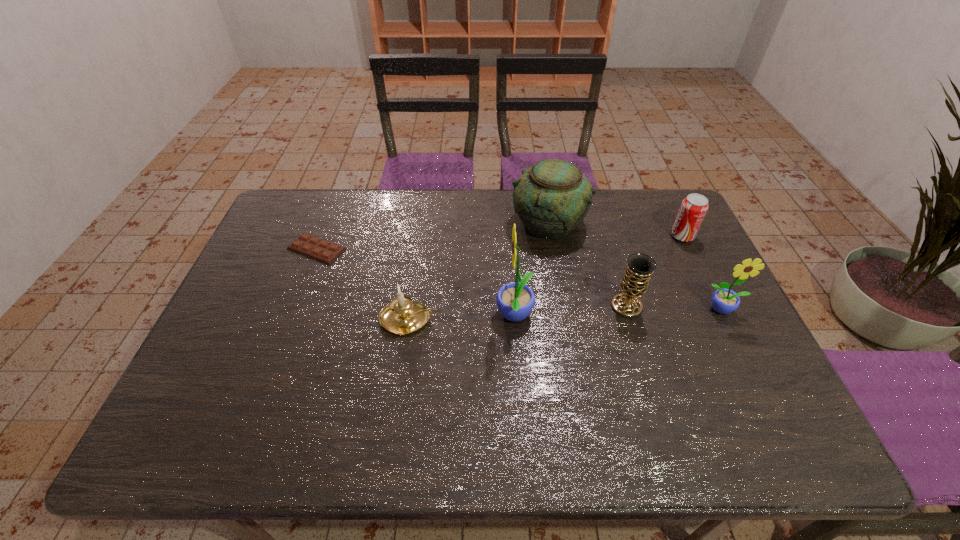
Find the location of a particular element. blank region between the leftmost object and the soda can is located at coordinates (499, 242).

Image resolution: width=960 pixels, height=540 pixels. What are the coordinates of `free spot between the leftmost object and the fifth object from left to right` in the screenshot? It's located at (471, 278).

You are a GUI agent. You are given a task and a screenshot of the screen. Output one action in this format:
    pyautogui.click(x=<x>, y=<y>)
    Task: Click on the free space between the third object from right to left and the pottery
    This screenshot has width=960, height=540.
    Given the screenshot: What is the action you would take?
    pyautogui.click(x=588, y=264)

The width and height of the screenshot is (960, 540). What are the coordinates of `vacant space that's between the third object from right to left and the pottery` in the screenshot? It's located at (588, 264).

Where is `vacant space in between the shortest object and the pottery`? vacant space in between the shortest object and the pottery is located at coordinates (433, 235).

The height and width of the screenshot is (540, 960). Identify the location of empty location between the soda can and the chocolate bar. (499, 242).

This screenshot has width=960, height=540. Identify the location of free space between the pottery and the taller sunflower. (532, 269).

Identify the location of vacant area between the left sunflower and the candle holder. (462, 318).

Identify the location of object identified as the fourth closest to the second object from left to right. (634, 284).

Identify the location of object that stands as the sixth closest to the left sunflower. The height and width of the screenshot is (540, 960). 693,209.